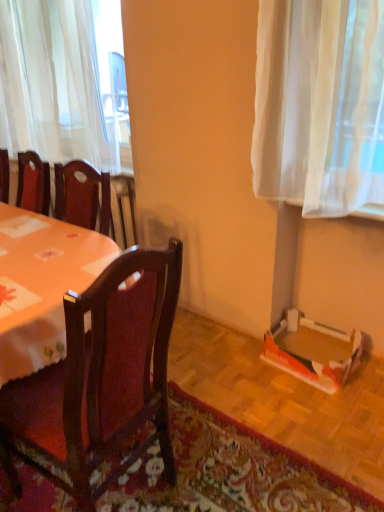
The image size is (384, 512). I want to click on vacant area that lies in front of orange cardboard box at lower right, so coord(324,407).